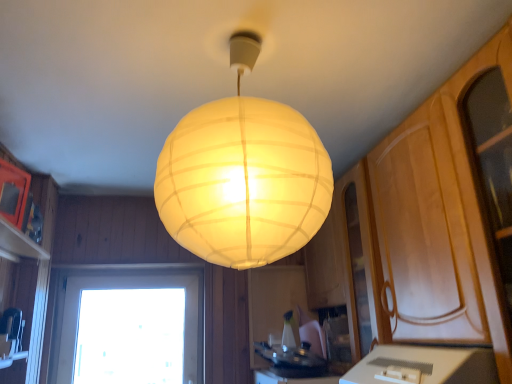
The width and height of the screenshot is (512, 384). Describe the element at coordinates (424, 366) in the screenshot. I see `white glossy countertop at lower center` at that location.

Image resolution: width=512 pixels, height=384 pixels. I want to click on transparent glass window at lower left, so click(x=127, y=326).

The height and width of the screenshot is (384, 512). What do you see at coordinates (127, 326) in the screenshot?
I see `transparent glass window at lower left` at bounding box center [127, 326].

Where is `white glossy countertop at lower center`? white glossy countertop at lower center is located at coordinates (424, 366).

In the scene shown: Can you confirm if transparent glass window at lower left is bigger than white paper lampshade at center?

No.

Is transparent glass window at lower left looking in the opposite direction of white paper lampshade at center?

No.

How different are the orientations of transparent glass window at lower left and white paper lampshade at center in degrees?

The angle between the facing direction of transparent glass window at lower left and the facing direction of white paper lampshade at center is 0.604 degrees.

How far apart are transparent glass window at lower left and white paper lampshade at center?

transparent glass window at lower left is 1.76 meters from white paper lampshade at center.

What's the angular difference between white paper lampshade at center and white glossy countertop at lower center's facing directions?

88.5 degrees separate the facing orientations of white paper lampshade at center and white glossy countertop at lower center.

From the picture: Is white paper lampshade at center further to the viewer compared to white glossy countertop at lower center?

No, it is not.

Is white paper lampshade at center at the right side of white glossy countertop at lower center?

No.

From a real-world perspective, is white paper lampshade at center below transparent glass window at lower left?

No, from a real-world perspective, white paper lampshade at center is not below transparent glass window at lower left.

Is point (300, 244) in front of point (112, 306)?

Yes.

Where is `lamp located on the right of transparent glass window at lower left`? This screenshot has height=384, width=512. lamp located on the right of transparent glass window at lower left is located at coordinates (243, 176).

Is white paper lampshade at center to the left or to the right of transparent glass window at lower left in the image?

white paper lampshade at center is positioned on transparent glass window at lower left's right side.

In the image, is transparent glass window at lower left positioned in front of or behind white glossy countertop at lower center?

transparent glass window at lower left is behind white glossy countertop at lower center.

Considering the sizes of objects transparent glass window at lower left and white glossy countertop at lower center in the image provided, who is smaller, transparent glass window at lower left or white glossy countertop at lower center?

transparent glass window at lower left.

Does transparent glass window at lower left have a greater width compared to white glossy countertop at lower center?

No.

Where is `window on the left of the white glossy countertop at lower center`? Image resolution: width=512 pixels, height=384 pixels. window on the left of the white glossy countertop at lower center is located at coordinates (127, 326).

Based on the photo, who is more distant, white glossy countertop at lower center or white paper lampshade at center?

white glossy countertop at lower center is further away from the camera.

From a real-world perspective, is white glossy countertop at lower center positioned above or below white paper lampshade at center?

From a real-world perspective, white glossy countertop at lower center is physically below white paper lampshade at center.

Based on the photo, considering the positions of objects white glossy countertop at lower center and white paper lampshade at center in the image provided, who is more to the right, white glossy countertop at lower center or white paper lampshade at center?

white glossy countertop at lower center.

Which is correct: white glossy countertop at lower center is inside white paper lampshade at center, or outside of it?

white glossy countertop at lower center exists outside the volume of white paper lampshade at center.

Could you measure the distance between white glossy countertop at lower center and transparent glass window at lower left?

1.51 meters.

From a real-world perspective, is white glossy countertop at lower center located higher than transparent glass window at lower left?

Incorrect, from a real-world perspective, white glossy countertop at lower center is lower than transparent glass window at lower left.

Considering the points (460, 374) and (96, 302), which point is behind, point (460, 374) or point (96, 302)?

Point (96, 302)

Is the position of white glossy countertop at lower center more distant than that of transparent glass window at lower left?

No, white glossy countertop at lower center is in front of transparent glass window at lower left.

You are a GUI agent. You are given a task and a screenshot of the screen. Output one action in this format:
    pyautogui.click(x=<x>, y=<y>)
    Task: Click on the lamp in front of the transparent glass window at lower left
    The height and width of the screenshot is (384, 512).
    Given the screenshot: What is the action you would take?
    (x=243, y=176)

This screenshot has height=384, width=512. Find the location of `lamp above the white glossy countertop at lower center (from the image's perspective)`. lamp above the white glossy countertop at lower center (from the image's perspective) is located at coordinates (243, 176).

Based on their spatial positions, is white paper lampshade at center or white glossy countertop at lower center further from transparent glass window at lower left?

white paper lampshade at center is positioned further to the anchor transparent glass window at lower left.

Looking at the image, which one is located further to white paper lampshade at center, white glossy countertop at lower center or transparent glass window at lower left?

Among the two, transparent glass window at lower left is located further to white paper lampshade at center.

Looking at the image, which one is located further to white glossy countertop at lower center, white paper lampshade at center or transparent glass window at lower left?

The object further to white glossy countertop at lower center is transparent glass window at lower left.

Based on their spatial positions, is transparent glass window at lower left or white glossy countertop at lower center closer to white paper lampshade at center?

Among the two, white glossy countertop at lower center is located nearer to white paper lampshade at center.

From the picture: From the image, which object appears to be farther from white glossy countertop at lower center, transparent glass window at lower left or white paper lampshade at center?

transparent glass window at lower left is positioned further to the anchor white glossy countertop at lower center.

When comparing their distances from transparent glass window at lower left, does white glossy countertop at lower center or white paper lampshade at center seem further?

white paper lampshade at center lies further to transparent glass window at lower left than the other object.

At what (x,y) coordinates should I click in order to perform the action: click on counter top positioned between white paper lampshade at center and transparent glass window at lower left from near to far. Please return your answer as a coordinate pair (x, y). The height and width of the screenshot is (384, 512). Looking at the image, I should click on (424, 366).